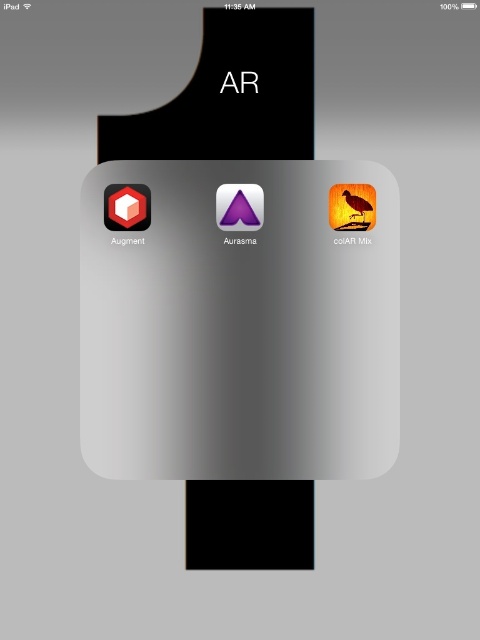
From the picture: Can you confirm if purple glossy triangle at center is bigger than orange glossy bird at center?

Indeed, purple glossy triangle at center has a larger size compared to orange glossy bird at center.

Between point (263, 214) and point (361, 237), which one is positioned in front?

Point (361, 237) is in front.

The height and width of the screenshot is (640, 480). What are the coordinates of `purple glossy triangle at center` in the screenshot? It's located at (240, 205).

Does purple glossy triangle at center come in front of matte purple triangle at center?

That is True.

Measure the distance between purple glossy triangle at center and matte purple triangle at center.

purple glossy triangle at center is 1.11 inches away from matte purple triangle at center.

Does point (259, 186) lie behind point (239, 237)?

No, it is not.

Identify the location of purple glossy triangle at center. (240, 205).

Is point (346, 237) closer to camera compared to point (243, 237)?

That is True.

The image size is (480, 640). What do you see at coordinates (352, 241) in the screenshot?
I see `orange glossy bird at center` at bounding box center [352, 241].

The height and width of the screenshot is (640, 480). What are the coordinates of `orange glossy bird at center` in the screenshot? It's located at (352, 241).

Locate an element on the screen. The width and height of the screenshot is (480, 640). orange glossy bird at center is located at coordinates point(352,241).